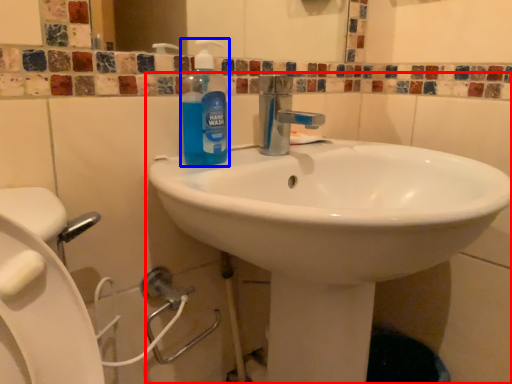
Question: Which object appears farthest to the camera in this image, sink (highlighted by a red box) or cleaning product (highlighted by a blue box)?

Choices:
 (A) sink
 (B) cleaning product

Answer: (B)